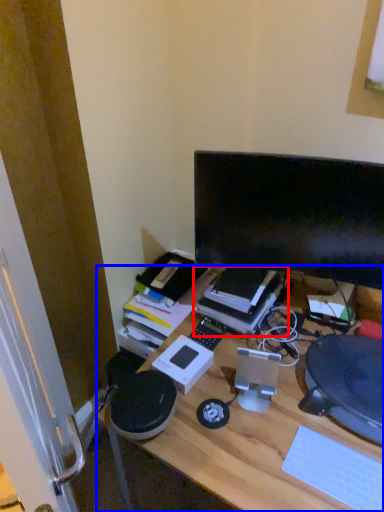
Question: Which object is closer to the camera taking this photo, book (highlighted by a red box) or desk (highlighted by a blue box)?

Choices:
 (A) book
 (B) desk

Answer: (B)